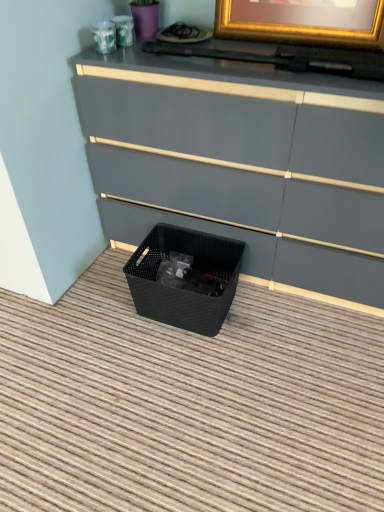
Question: Considering the relative positions of black woven basket at lower center and matte black storage bin at lower left in the image provided, is black woven basket at lower center to the left or to the right of matte black storage bin at lower left?

Choices:
 (A) left
 (B) right

Answer: (A)

Question: Looking at their shapes, would you say black woven basket at lower center is wider or thinner than matte black storage bin at lower left?

Choices:
 (A) wide
 (B) thin

Answer: (B)

Question: From a real-world perspective, relative to matte black storage bin at lower left, is black woven basket at lower center vertically above or below?

Choices:
 (A) below
 (B) above

Answer: (A)

Question: In the image, is matte black storage bin at lower left on the left side or the right side of black woven basket at lower center?

Choices:
 (A) right
 (B) left

Answer: (A)

Question: From a real-world perspective, is matte black storage bin at lower left above or below black woven basket at lower center?

Choices:
 (A) above
 (B) below

Answer: (A)

Question: Is matte black storage bin at lower left wider or thinner than black woven basket at lower center?

Choices:
 (A) wide
 (B) thin

Answer: (A)

Question: Considering the positions of matte black storage bin at lower left and black woven basket at lower center in the image, is matte black storage bin at lower left bigger or smaller than black woven basket at lower center?

Choices:
 (A) small
 (B) big

Answer: (B)